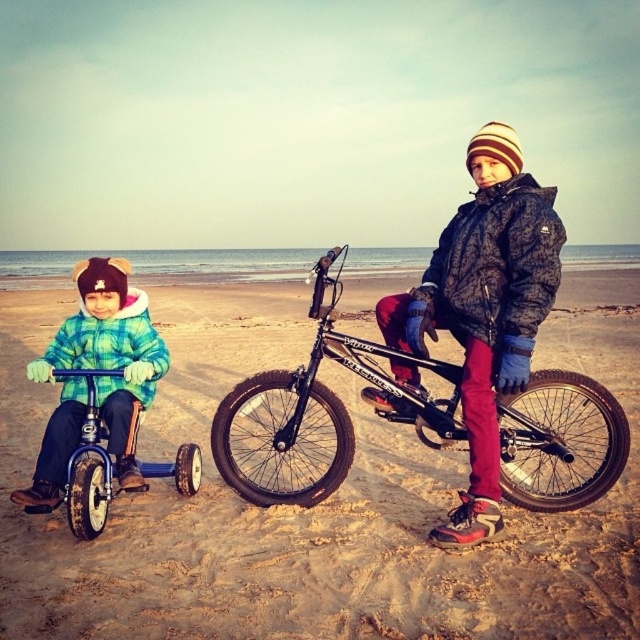
You are a photographer trying to capture a clear shot of the blue plastic tricycle at left without the camouflage jacket at center blocking it. What should you do?

The camouflage jacket at center is positioned over the blue plastic tricycle at left, so you should move your camera angle downward to avoid the jacket blocking the tricycle.

You are a photographer trying to capture a shot of the flannel plaid jacket at left and the blue plastic tricycle at left. Your camera can only focus on objects within a 6 inch range. Will both objects be in focus?

The distance between the flannel plaid jacket at left and the blue plastic tricycle at left is 6.56 inches, which exceeds the camera focus range of 6 inches. Therefore, both objects cannot be in focus simultaneously.

You are a photographer standing at the edge of the beach. You want to take a photo that includes both the point at point [195,547] and the point at point [124,326]. Which point should you focus on first to ensure both are in clear view?

You should focus on point [195,547] first because it is closer to the viewer than point [124,326], ensuring both points are in clear view.